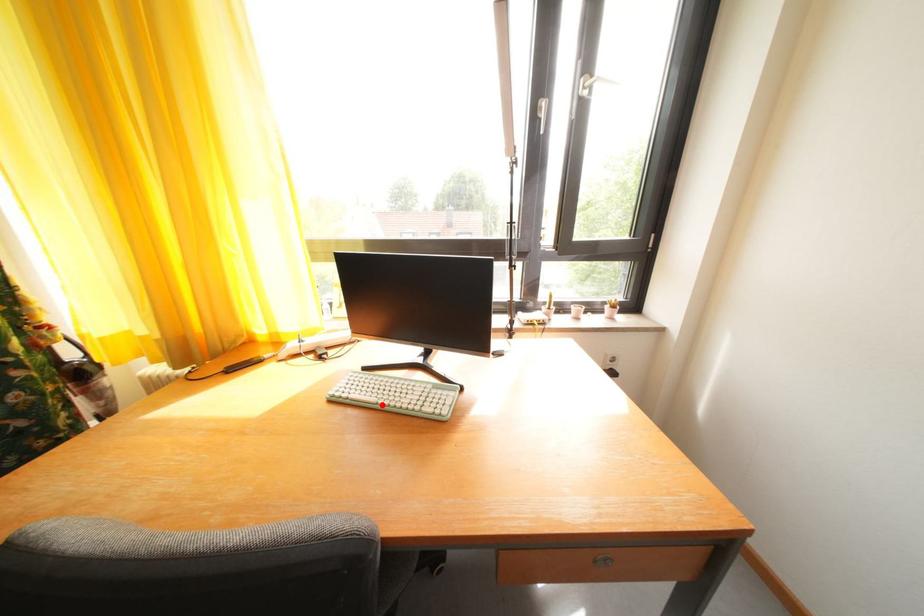
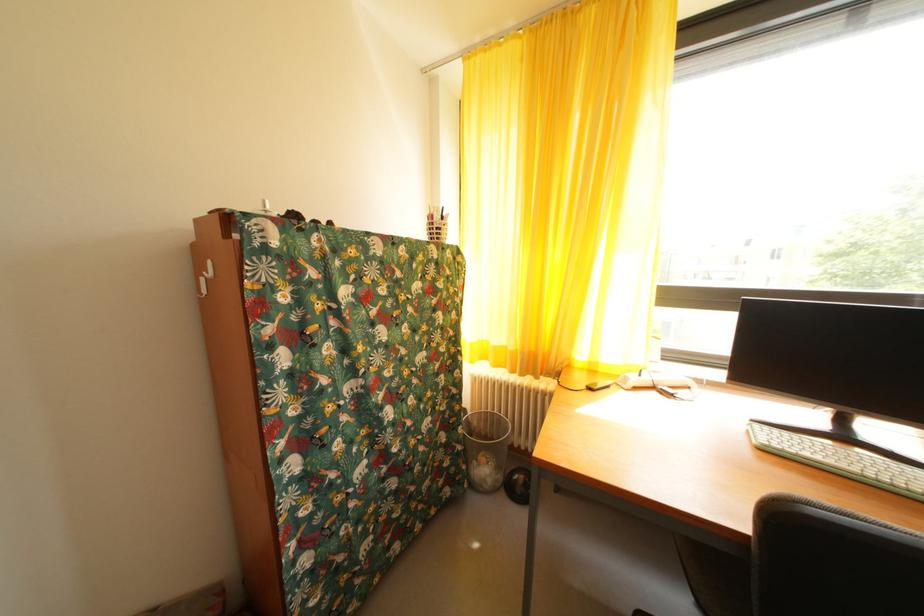
Locate, in the second image, the point that corresponds to the highlighted location in the first image.

(854, 472)